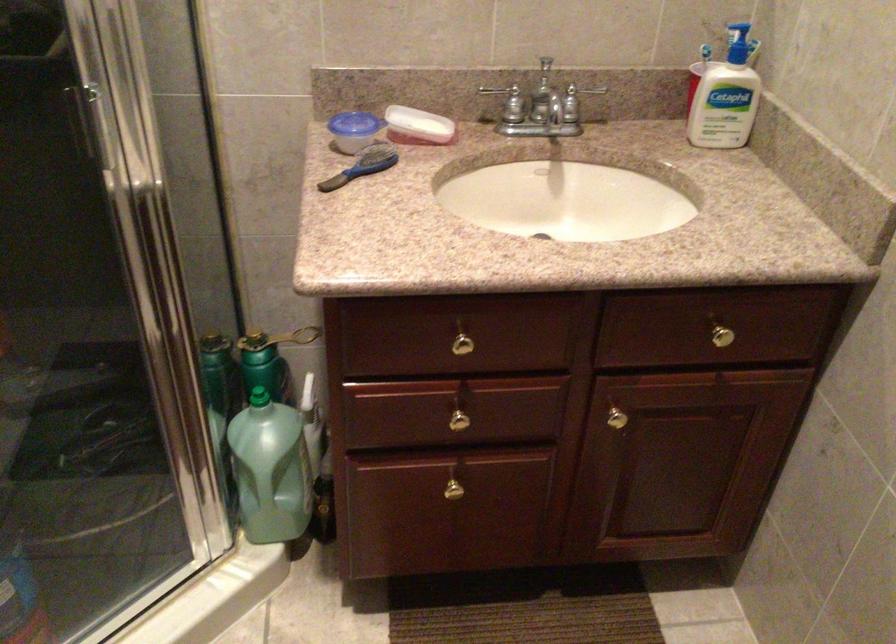
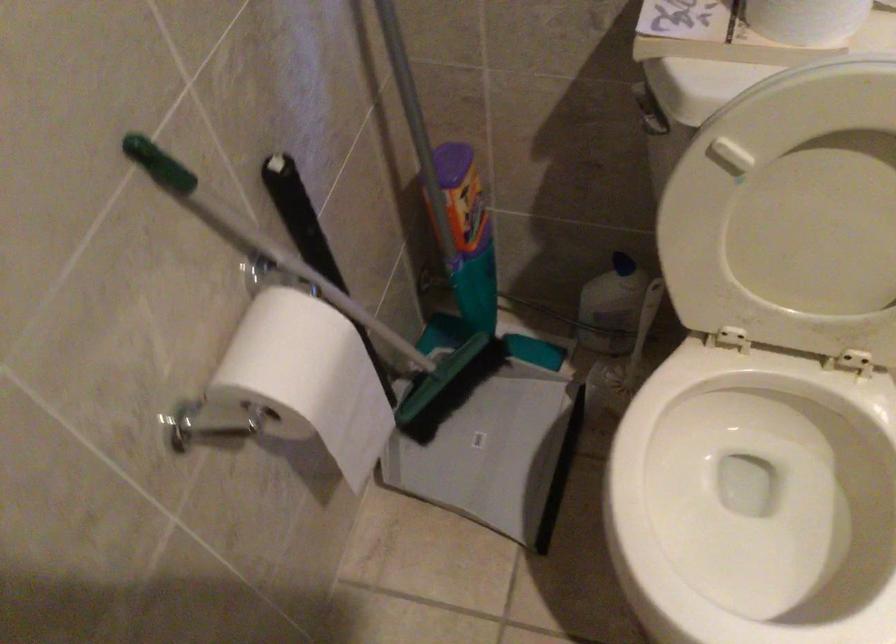
The images are taken continuously from a first-person perspective. In which direction is your viewpoint rotating?

The camera rotated toward left-down.